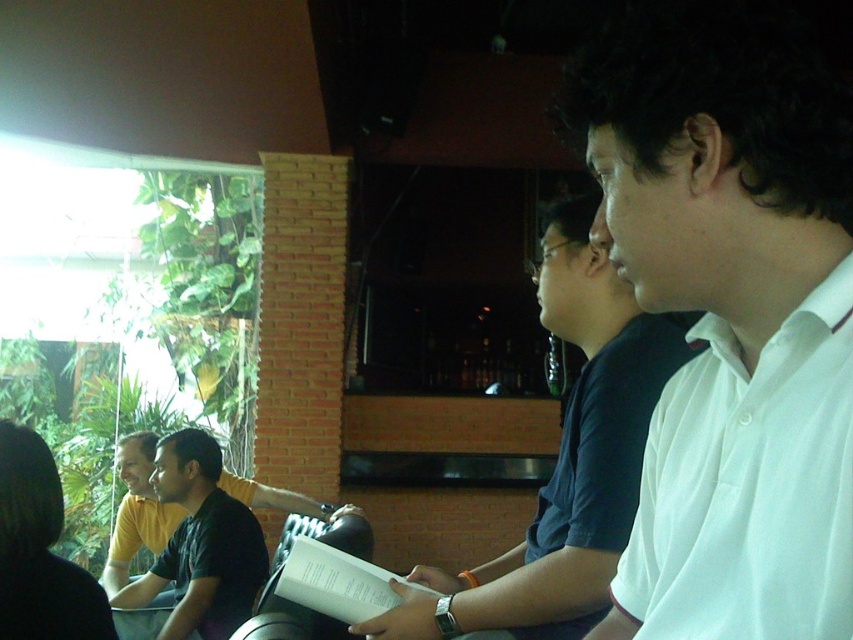
Question: Which point is farther to the camera?

Choices:
 (A) click(x=567, y=524)
 (B) click(x=189, y=618)
 (C) click(x=699, y=177)

Answer: (B)

Question: Among these objects, which one is farthest from the camera?

Choices:
 (A) white cotton shirt at right
 (B) white smooth shirt at center
 (C) dark green shirt at center

Answer: (C)

Question: Can you confirm if white smooth shirt at center is bigger than dark green shirt at center?

Choices:
 (A) no
 (B) yes

Answer: (A)

Question: Can you confirm if white cotton shirt at right is positioned to the left of dark green shirt at center?

Choices:
 (A) no
 (B) yes

Answer: (A)

Question: Based on their relative distances, which object is nearer to the dark green shirt at center?

Choices:
 (A) white smooth shirt at center
 (B) white cotton shirt at right

Answer: (B)

Question: Does white smooth shirt at center lie behind white cotton shirt at right?

Choices:
 (A) yes
 (B) no

Answer: (B)